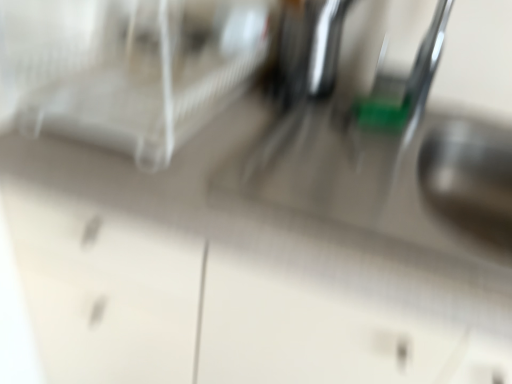
Where is `satin nickel faucet at upper center`? The image size is (512, 384). satin nickel faucet at upper center is located at coordinates (391, 161).

What is the approximate width of satin nickel faucet at upper center?

satin nickel faucet at upper center is 21.39 inches in width.

The height and width of the screenshot is (384, 512). What do you see at coordinates (391, 161) in the screenshot? I see `satin nickel faucet at upper center` at bounding box center [391, 161].

I want to click on satin nickel faucet at upper center, so click(391, 161).